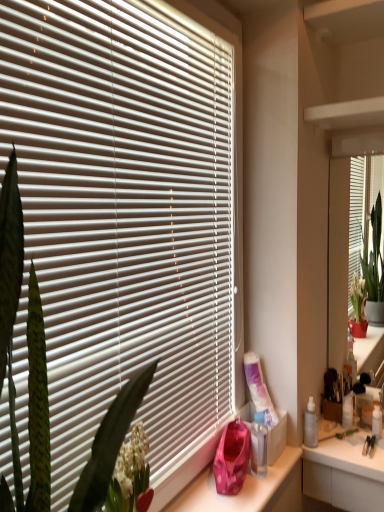
You are a GUI agent. You are given a task and a screenshot of the screen. Output one action in this format:
    pyautogui.click(x=<x>, y=<y>)
    Task: Click on the blank space above white glossy counter at lower right (from a real-world perspective)
    This screenshot has height=512, width=384.
    Given the screenshot: What is the action you would take?
    pyautogui.click(x=350, y=439)